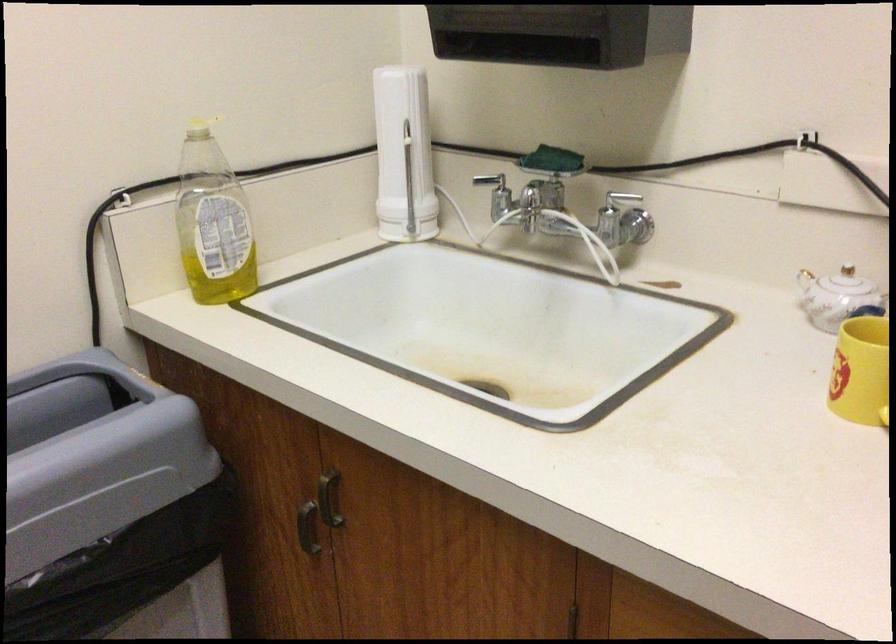
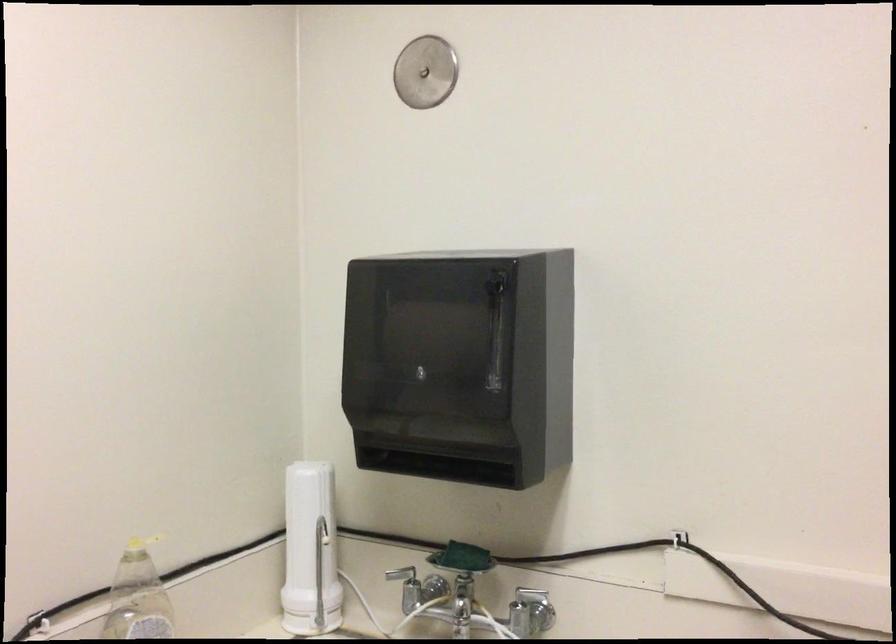
In the second image, find the point that corresponds to (400,160) in the first image.

(309, 551)